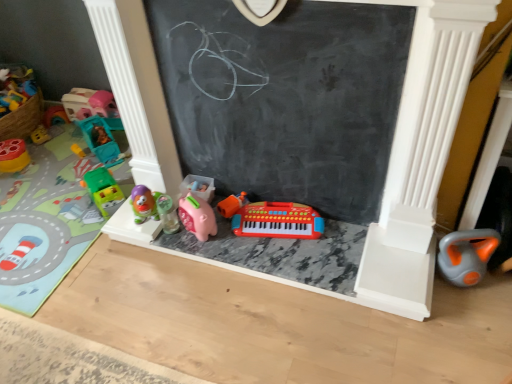
You are a GUI agent. You are given a task and a screenshot of the screen. Output one action in this format:
    pyautogui.click(x=<x>, y=<y>)
    Task: Click on the orange rubber toy at lower right, the 8th toy in the left-to-right sequence
    Image resolution: width=512 pixels, height=384 pixels.
    Given the screenshot: What is the action you would take?
    (466, 255)

This screenshot has width=512, height=384. Describe the element at coordinates (167, 213) in the screenshot. I see `translucent plastic toy at center, acting as the third toy starting from the right` at that location.

What do you see at coordinates (92, 106) in the screenshot? I see `translucent plastic car at upper left, which is counted as the 3th toy, starting from the left` at bounding box center [92, 106].

In order to face translucent plastic toy car at left, positioned as the fifth toy in right-to-left order, should I rotate leftwards or rightwards?

Rotate left and turn 21.118 degrees.

The width and height of the screenshot is (512, 384). Describe the element at coordinates (197, 216) in the screenshot. I see `pink rubber piggy bank at center, which is the 2th toy in right-to-left order` at that location.

What is the approximate width of pink rubber piggy bank at center, the seventh toy from the left?

12.76 centimeters.

What are the coordinates of `green plastic toy car at left, which is the 4th toy from right to left` in the screenshot? It's located at (103, 191).

The image size is (512, 384). Describe the element at coordinates (285, 98) in the screenshot. I see `black chalkboard at center` at that location.

You are a GUI agent. You are given a task and a screenshot of the screen. Output one action in this format:
    pyautogui.click(x=<x>, y=<y>)
    Task: Click on the orange rubber toy at lower right, the 8th toy in the left-to-right sequence
    The width and height of the screenshot is (512, 384).
    Given the screenshot: What is the action you would take?
    pyautogui.click(x=466, y=255)

Can you confirm if orange rubber toy at lower right, arranged as the 1th toy when viewed from the right, is positioned to the right of black chalkboard at center?

Yes, orange rubber toy at lower right, arranged as the 1th toy when viewed from the right, is to the right of black chalkboard at center.

This screenshot has height=384, width=512. In order to click on the 1st toy behind the black chalkboard at center, starting your count from the anchor in this screenshot , I will do `click(466, 255)`.

Between orange rubber toy at lower right, the 8th toy in the left-to-right sequence, and black chalkboard at center, which one has smaller width?

Thinner between the two is black chalkboard at center.

From the image's perspective, is orange rubber toy at lower right, arranged as the 1th toy when viewed from the right, under black chalkboard at center?

Yes, from the image's perspective, orange rubber toy at lower right, arranged as the 1th toy when viewed from the right, is below black chalkboard at center.

Which is behind, point (102, 120) or point (18, 153)?

Positioned behind is point (102, 120).

The width and height of the screenshot is (512, 384). Find the location of `toy that is the 1st one when counting upward from the matte yellow and red toy at left, arranged as the 8th toy when viewed from the right (from the image's perspective)`. toy that is the 1st one when counting upward from the matte yellow and red toy at left, arranged as the 8th toy when viewed from the right (from the image's perspective) is located at coordinates (101, 140).

Is translucent plastic toy car at left, which is the fourth toy in left-to-right order, located outside matte yellow and red toy at left, the 1th toy from the left?

translucent plastic toy car at left, which is the fourth toy in left-to-right order, is positioned outside matte yellow and red toy at left, the 1th toy from the left.

Between translucent plastic toy car at left, positioned as the fifth toy in right-to-left order, and matte yellow and red toy at left, arranged as the 8th toy when viewed from the right, which one appears on the left side from the viewer's perspective?

Positioned to the left is matte yellow and red toy at left, arranged as the 8th toy when viewed from the right.

Does translucent plastic toy car at left, which is the fourth toy in left-to-right order, have a lesser height compared to translucent plastic toy at center, the sixth toy in the left-to-right sequence?

Yes, translucent plastic toy car at left, which is the fourth toy in left-to-right order, is shorter than translucent plastic toy at center, the sixth toy in the left-to-right sequence.

Does translucent plastic toy car at left, positioned as the fifth toy in right-to-left order, come in front of translucent plastic toy at center, acting as the third toy starting from the right?

No, translucent plastic toy car at left, positioned as the fifth toy in right-to-left order, is further to the viewer.

From the image's perspective, which one is positioned lower, translucent plastic toy car at left, which is the fourth toy in left-to-right order, or translucent plastic toy at center, the sixth toy in the left-to-right sequence?

From the image's view, translucent plastic toy at center, the sixth toy in the left-to-right sequence, is below.

Where is `toy that is the 2nd one when counting rightward from the translucent plastic toy car at left, positioned as the fifth toy in right-to-left order`? Image resolution: width=512 pixels, height=384 pixels. toy that is the 2nd one when counting rightward from the translucent plastic toy car at left, positioned as the fifth toy in right-to-left order is located at coordinates (167, 213).

Which is correct: black chalkboard at center is inside matte yellow and red toy at left, the 1th toy from the left, or outside of it?

black chalkboard at center is outside matte yellow and red toy at left, the 1th toy from the left.

From a real-world perspective, between black chalkboard at center and matte yellow and red toy at left, the 1th toy from the left, who is vertically lower?

matte yellow and red toy at left, the 1th toy from the left.

How distant is black chalkboard at center from matte yellow and red toy at left, the 1th toy from the left?

black chalkboard at center and matte yellow and red toy at left, the 1th toy from the left, are 1.55 meters apart.

From the picture: How different are the orientations of black chalkboard at center and matte yellow and red toy at left, the 1th toy from the left, in degrees?

2.57 degrees.

Which of these two, matte yellow and red toy at left, arranged as the 8th toy when viewed from the right, or green plastic toy car at left, the 5th toy in the left-to-right sequence, is smaller?

Smaller between the two is matte yellow and red toy at left, arranged as the 8th toy when viewed from the right.

Does point (6, 143) lie behind point (112, 176)?

Yes.

Consider the image. In terms of height, does matte yellow and red toy at left, the 1th toy from the left, look taller or shorter compared to green plastic toy car at left, which is the 4th toy from right to left?

Clearly, matte yellow and red toy at left, the 1th toy from the left, is shorter compared to green plastic toy car at left, which is the 4th toy from right to left.

The image size is (512, 384). Identify the location of toy that is the 1st one below the green plastic toy car at left, which is the 4th toy from right to left (from a real-world perspective). [x=13, y=156].

Which toy is the 6th one when counting from the left side of the black chalkboard at center? Please provide its 2D coordinates.

[(45, 219)]

Is there a large distance between black chalkboard at center and green plastic toy car at left, the 7th toy positioned from the right?

Yes, black chalkboard at center and green plastic toy car at left, the 7th toy positioned from the right, are located far from each other.

Between black chalkboard at center and green plastic toy car at left, positioned as the second toy in left-to-right order, which one appears on the left side from the viewer's perspective?

green plastic toy car at left, positioned as the second toy in left-to-right order.

Based on the photo, between black chalkboard at center and green plastic toy car at left, the 7th toy positioned from the right, which one has smaller size?

With smaller size is black chalkboard at center.

Based on the photo, which of these two, black chalkboard at center or green plastic toy car at left, the 5th toy in the left-to-right sequence, is smaller?

Smaller between the two is green plastic toy car at left, the 5th toy in the left-to-right sequence.

From the image's perspective, which is above, black chalkboard at center or green plastic toy car at left, which is the 4th toy from right to left?

black chalkboard at center, from the image's perspective.

Is black chalkboard at center taller or shorter than green plastic toy car at left, which is the 4th toy from right to left?

In the image, black chalkboard at center appears to be taller than green plastic toy car at left, which is the 4th toy from right to left.

Between black chalkboard at center and green plastic toy car at left, the 5th toy in the left-to-right sequence, which one is positioned in front?

black chalkboard at center.

At what (x,y) coordinates should I click in order to perform the action: click on bulletin board on the left of orange rubber toy at lower right, arranged as the 1th toy when viewed from the right. Please return your answer as a coordinate pair (x, y). Image resolution: width=512 pixels, height=384 pixels. Looking at the image, I should click on (285, 98).

Locate an element on the screen. The width and height of the screenshot is (512, 384). the 1st toy in front of the matte yellow and red toy at left, arranged as the 8th toy when viewed from the right, starting your count from the anchor is located at coordinates (101, 140).

Consider the image. Based on their spatial positions, is black chalkboard at center or translucent plastic car at upper left, placed as the sixth toy when sorted from right to left, closer to green plastic toy car at left, which is the 4th toy from right to left?

translucent plastic car at upper left, placed as the sixth toy when sorted from right to left, lies closer to green plastic toy car at left, which is the 4th toy from right to left, than the other object.

Estimate the real-world distances between objects in this image. Which object is closer to matte yellow and red toy at left, arranged as the 8th toy when viewed from the right, green plastic toy car at left, which is the 4th toy from right to left, or translucent plastic car at upper left, placed as the sixth toy when sorted from right to left?

translucent plastic car at upper left, placed as the sixth toy when sorted from right to left, lies closer to matte yellow and red toy at left, arranged as the 8th toy when viewed from the right, than the other object.

Based on their spatial positions, is green plastic toy car at left, positioned as the second toy in left-to-right order, or green plastic toy car at left, the 5th toy in the left-to-right sequence, closer to pink rubber piggy bank at center, the seventh toy from the left?

green plastic toy car at left, the 5th toy in the left-to-right sequence, is positioned closer to the anchor pink rubber piggy bank at center, the seventh toy from the left.

Looking at the image, which one is located further to pink rubber piggy bank at center, which is the 2th toy in right-to-left order, green plastic toy car at left, the 7th toy positioned from the right, or black chalkboard at center?

green plastic toy car at left, the 7th toy positioned from the right, is positioned further to the anchor pink rubber piggy bank at center, which is the 2th toy in right-to-left order.

From the image, which object appears to be nearer to green plastic toy car at left, the 5th toy in the left-to-right sequence, translucent plastic toy at center, the sixth toy in the left-to-right sequence, or translucent plastic toy car at left, positioned as the fifth toy in right-to-left order?

translucent plastic toy car at left, positioned as the fifth toy in right-to-left order.

Estimate the real-world distances between objects in this image. Which object is closer to pink rubber piggy bank at center, the seventh toy from the left, matte yellow and red toy at left, the 1th toy from the left, or green plastic toy car at left, the 7th toy positioned from the right?

green plastic toy car at left, the 7th toy positioned from the right, is positioned closer to the anchor pink rubber piggy bank at center, the seventh toy from the left.

Based on their spatial positions, is green plastic toy car at left, the 7th toy positioned from the right, or translucent plastic toy car at left, positioned as the fifth toy in right-to-left order, further from orange rubber toy at lower right, the 8th toy in the left-to-right sequence?

The object further to orange rubber toy at lower right, the 8th toy in the left-to-right sequence, is translucent plastic toy car at left, positioned as the fifth toy in right-to-left order.

When comparing their distances from translucent plastic toy car at left, positioned as the fifth toy in right-to-left order, does pink rubber piggy bank at center, the seventh toy from the left, or matte yellow and red toy at left, arranged as the 8th toy when viewed from the right, seem further?

The object further to translucent plastic toy car at left, positioned as the fifth toy in right-to-left order, is pink rubber piggy bank at center, the seventh toy from the left.

The height and width of the screenshot is (384, 512). I want to click on toy located between translucent plastic toy car at left, which is the fourth toy in left-to-right order, and translucent plastic toy at center, acting as the third toy starting from the right, in the left-right direction, so click(103, 191).

I want to click on bulletin board located between translucent plastic toy car at left, which is the fourth toy in left-to-right order, and orange rubber toy at lower right, the 8th toy in the left-to-right sequence, in the left-right direction, so click(285, 98).

Identify the location of bulletin board between translucent plastic toy at center, acting as the third toy starting from the right, and orange rubber toy at lower right, arranged as the 1th toy when viewed from the right, in the horizontal direction. (285, 98).

At what (x,y) coordinates should I click in order to perform the action: click on bulletin board situated between pink rubber piggy bank at center, the seventh toy from the left, and orange rubber toy at lower right, arranged as the 1th toy when viewed from the right, from left to right. Please return your answer as a coordinate pair (x, y). The image size is (512, 384). Looking at the image, I should click on (285, 98).